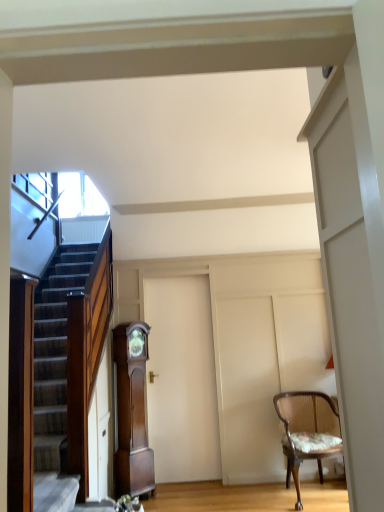
In order to click on mahogany wood grandfather clock at center in this screenshot , I will do `click(132, 411)`.

Measure the distance between point (145, 369) and camera.

12.88 feet.

Where is `wooden textured chair at right`? wooden textured chair at right is located at coordinates (307, 431).

Is wooden textured chair at right bigger than mahogany wood grandfather clock at center?

Indeed, wooden textured chair at right has a larger size compared to mahogany wood grandfather clock at center.

Is wooden textured chair at right aimed at mahogany wood grandfather clock at center?

No, wooden textured chair at right is not aimed at mahogany wood grandfather clock at center.

Considering the sizes of objects wooden textured chair at right and mahogany wood grandfather clock at center in the image provided, who is taller, wooden textured chair at right or mahogany wood grandfather clock at center?

mahogany wood grandfather clock at center is taller.

Consider the image. Choose the correct answer: Is wooden textured chair at right inside mahogany wood grandfather clock at center or outside it?

wooden textured chair at right cannot be found inside mahogany wood grandfather clock at center.

Can you confirm if white matte door at center is wider than wooden textured chair at right?

Incorrect, the width of white matte door at center does not surpass that of wooden textured chair at right.

Would you say white matte door at center is inside or outside wooden textured chair at right?

white matte door at center is not inside wooden textured chair at right, it's outside.

Is white matte door at center placed right next to wooden textured chair at right?

No, white matte door at center is not touching wooden textured chair at right.

Is white matte door at center to the left or to the right of wooden textured chair at right in the image?

Clearly, white matte door at center is on the left of wooden textured chair at right in the image.

From a real-world perspective, is white matte door at center on mahogany wood grandfather clock at center?

Yes.

Is white matte door at center further to camera compared to mahogany wood grandfather clock at center?

Yes, it is.

From the image's perspective, is white matte door at center on top of mahogany wood grandfather clock at center?

Indeed, from the image's perspective, white matte door at center is shown above mahogany wood grandfather clock at center.

Is white matte door at center inside the boundaries of mahogany wood grandfather clock at center, or outside?

The correct answer is: outside.

Does wooden textured chair at right turn towards white matte door at center?

No, wooden textured chair at right does not turn towards white matte door at center.

From a real-world perspective, is wooden textured chair at right over white matte door at center?

Incorrect, from a real-world perspective, wooden textured chair at right is lower than white matte door at center.

Looking at this image, does wooden textured chair at right have a lesser width compared to white matte door at center?

No, wooden textured chair at right is not thinner than white matte door at center.

Are wooden textured chair at right and white matte door at center far apart?

wooden textured chair at right is actually quite close to white matte door at center.

The image size is (384, 512). I want to click on cabinetry above the wooden textured chair at right (from the image's perspective), so click(x=132, y=411).

Is mahogany wood grandfather clock at center in front of or behind wooden textured chair at right in the image?

mahogany wood grandfather clock at center is positioned farther from the viewer than wooden textured chair at right.

Is mahogany wood grandfather clock at center oriented towards wooden textured chair at right?

No, mahogany wood grandfather clock at center does not turn towards wooden textured chair at right.

Between mahogany wood grandfather clock at center and wooden textured chair at right, which one has smaller width?

Thinner between the two is mahogany wood grandfather clock at center.

Would you consider mahogany wood grandfather clock at center to be distant from white matte door at center?

No, there isn't a large distance between mahogany wood grandfather clock at center and white matte door at center.

From a real-world perspective, is mahogany wood grandfather clock at center positioned above or below white matte door at center?

mahogany wood grandfather clock at center is below white matte door at center.

How distant is mahogany wood grandfather clock at center from white matte door at center?

They are 45.67 centimeters apart.

Does mahogany wood grandfather clock at center have a greater height compared to white matte door at center?

Incorrect, the height of mahogany wood grandfather clock at center is not larger of that of white matte door at center.

You are a GUI agent. You are given a task and a screenshot of the screen. Output one action in this format:
    pyautogui.click(x=<x>, y=<y>)
    Task: Click on the chair lying in front of the mahogany wood grandfather clock at center
    Image resolution: width=384 pixels, height=512 pixels.
    Given the screenshot: What is the action you would take?
    pyautogui.click(x=307, y=431)

Where is `door located above the wooden textured chair at right (from the image's perspective)`? The width and height of the screenshot is (384, 512). door located above the wooden textured chair at right (from the image's perspective) is located at coordinates (182, 380).

Estimate the real-world distances between objects in this image. Which object is further from wooden textured chair at right, mahogany wood grandfather clock at center or white matte door at center?

Based on the image, mahogany wood grandfather clock at center appears to be further to wooden textured chair at right.

When comparing their distances from mahogany wood grandfather clock at center, does wooden textured chair at right or white matte door at center seem closer?

white matte door at center.

Considering their positions, is white matte door at center positioned closer to mahogany wood grandfather clock at center than wooden textured chair at right?

Among the two, white matte door at center is located nearer to mahogany wood grandfather clock at center.

Considering their positions, is mahogany wood grandfather clock at center positioned further to white matte door at center than wooden textured chair at right?

wooden textured chair at right lies further to white matte door at center than the other object.

Looking at the image, which one is located closer to white matte door at center, wooden textured chair at right or mahogany wood grandfather clock at center?

mahogany wood grandfather clock at center is closer to white matte door at center.

From the image, which object appears to be nearer to wooden textured chair at right, white matte door at center or mahogany wood grandfather clock at center?

Among the two, white matte door at center is located nearer to wooden textured chair at right.

This screenshot has height=512, width=384. I want to click on door between mahogany wood grandfather clock at center and wooden textured chair at right in the horizontal direction, so click(x=182, y=380).